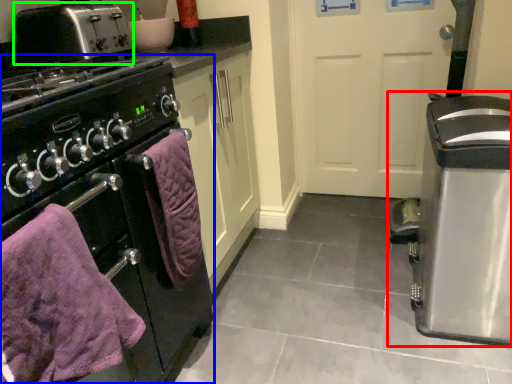
Question: Which object is the farthest from kitchen appliance (highlighted by a red box)? Choose among these: home appliance (highlighted by a blue box) or toaster (highlighted by a green box).

Choices:
 (A) home appliance
 (B) toaster

Answer: (B)